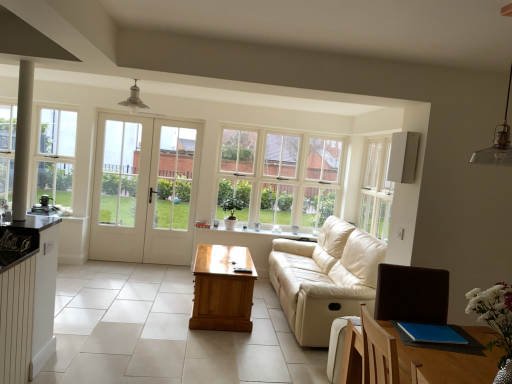
Identify the location of space that is in front of white glass door at center. (134, 277).